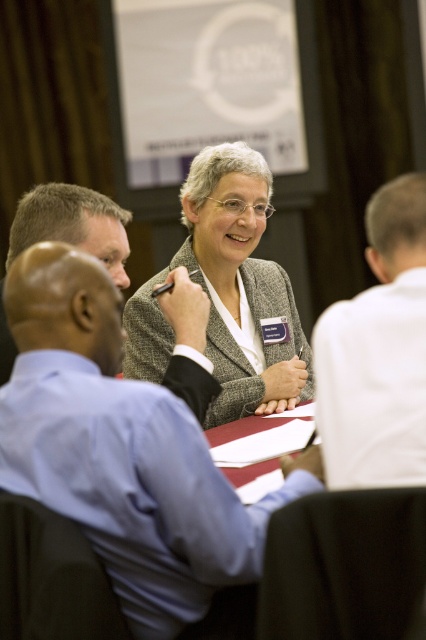
Does white shirt at right appear on the right side of blue shirt at left?

Correct, you'll find white shirt at right to the right of blue shirt at left.

Does point (368, 477) come in front of point (17, 208)?

Yes, point (368, 477) is closer to viewer.

The image size is (426, 640). Identify the location of white shirt at right. (377, 353).

Locate an element on the screen. white shirt at right is located at coordinates (377, 353).

Is blue shirt at center wider than textured gray blazer at center?

Correct, the width of blue shirt at center exceeds that of textured gray blazer at center.

Which is above, blue shirt at center or textured gray blazer at center?

textured gray blazer at center is above.

Describe the element at coordinates (121, 449) in the screenshot. I see `blue shirt at center` at that location.

At what (x,y) coordinates should I click in order to perform the action: click on blue shirt at center. Please return your answer as a coordinate pair (x, y). Looking at the image, I should click on (121, 449).

Does textured gray blazer at center lie in front of blue shirt at left?

That is False.

Can you confirm if textured gray blazer at center is shorter than blue shirt at left?

Incorrect, textured gray blazer at center's height does not fall short of blue shirt at left's.

Does point (218, 305) come closer to viewer compared to point (74, 214)?

No, it is not.

Where is `textured gray blazer at center`? The height and width of the screenshot is (640, 426). textured gray blazer at center is located at coordinates (241, 285).